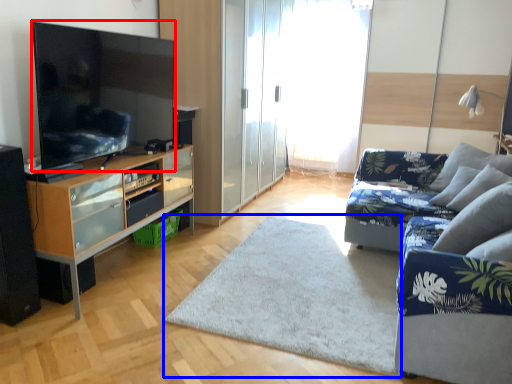
Question: Among these objects, which one is nearest to the camera, television (highlighted by a red box) or plain (highlighted by a blue box)?

Choices:
 (A) television
 (B) plain

Answer: (B)